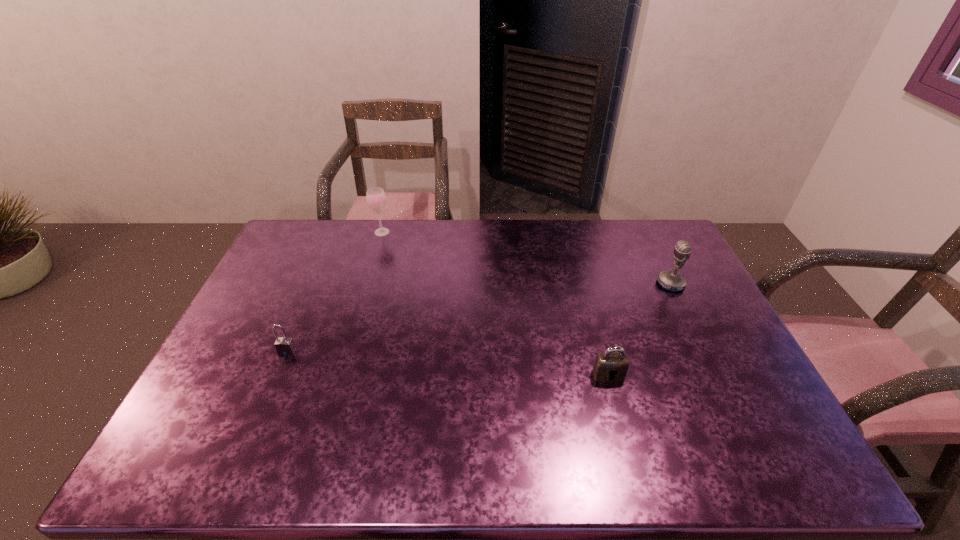
Where is `free space at the right edge of the desktop`? free space at the right edge of the desktop is located at coordinates (753, 428).

You are a GUI agent. You are given a task and a screenshot of the screen. Output one action in this format:
    pyautogui.click(x=<x>, y=<y>)
    Task: Click on the free location at the far left corner
    This screenshot has width=960, height=540.
    Given the screenshot: What is the action you would take?
    click(x=281, y=249)

Identify the location of empty location between the second object from left to right and the rightmost object. (526, 258).

You are a GUI agent. You are given a task and a screenshot of the screen. Output one action in this format:
    pyautogui.click(x=<x>, y=<y>)
    Task: Click on the vacant space in between the third farthest object and the second object from left to right
    The height and width of the screenshot is (540, 960).
    Given the screenshot: What is the action you would take?
    pyautogui.click(x=335, y=292)

Locate an element on the screen. Image resolution: width=960 pixels, height=540 pixels. unoccupied position between the farthest object and the third object from left to right is located at coordinates (495, 303).

This screenshot has width=960, height=540. In order to click on free space between the third object from right to left and the right padlock in this screenshot , I will do click(x=495, y=303).

Identify the location of free space between the third nearest object and the farthest object. (526, 258).

Identify the location of free space that is in between the third object from left to right and the second object from left to right. (495, 303).

This screenshot has width=960, height=540. Find the location of `vacant area that lies between the nearer padlock and the third nearest object`. vacant area that lies between the nearer padlock and the third nearest object is located at coordinates (639, 329).

At what (x,y) coordinates should I click in order to perform the action: click on free spot between the third farthest object and the nearer padlock. Please return your answer as a coordinate pair (x, y). Looking at the image, I should click on (447, 363).